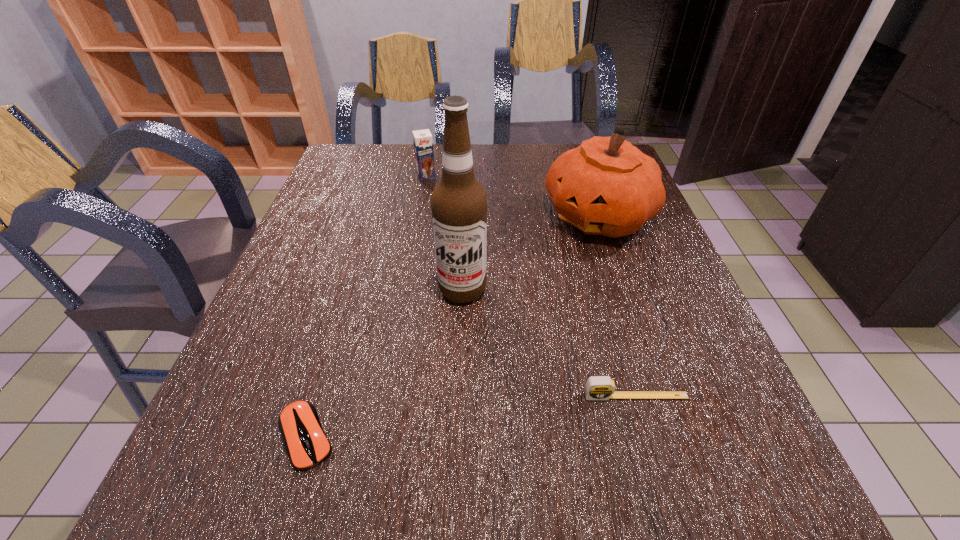
This screenshot has height=540, width=960. In order to click on vacant space at the left edge in this screenshot , I will do `click(343, 214)`.

Locate an element on the screen. free space at the right edge of the desktop is located at coordinates (646, 232).

At what (x,y) coordinates should I click in order to perform the action: click on vacant area at the near left corner of the desktop. Please return your answer as a coordinate pair (x, y). Looking at the image, I should click on (264, 419).

Locate an element on the screen. free point between the tape measure and the second object from left to right is located at coordinates (531, 286).

Where is `free spot between the fourth tallest object and the chocolate milk`? free spot between the fourth tallest object and the chocolate milk is located at coordinates (531, 286).

Where is `vacant point located between the fourth shortest object and the fourth object from right to left`? This screenshot has width=960, height=540. vacant point located between the fourth shortest object and the fourth object from right to left is located at coordinates [513, 197].

Image resolution: width=960 pixels, height=540 pixels. I want to click on vacant region between the leftmost object and the tape measure, so click(x=471, y=416).

This screenshot has width=960, height=540. Identify the location of vacant area between the pumpkin and the alcohol. (531, 253).

Find the location of a particular element. free space between the alcohol and the nearest object is located at coordinates (384, 363).

The image size is (960, 540). In order to click on vacant point located between the pumpkin and the tallest object in this screenshot , I will do `click(531, 253)`.